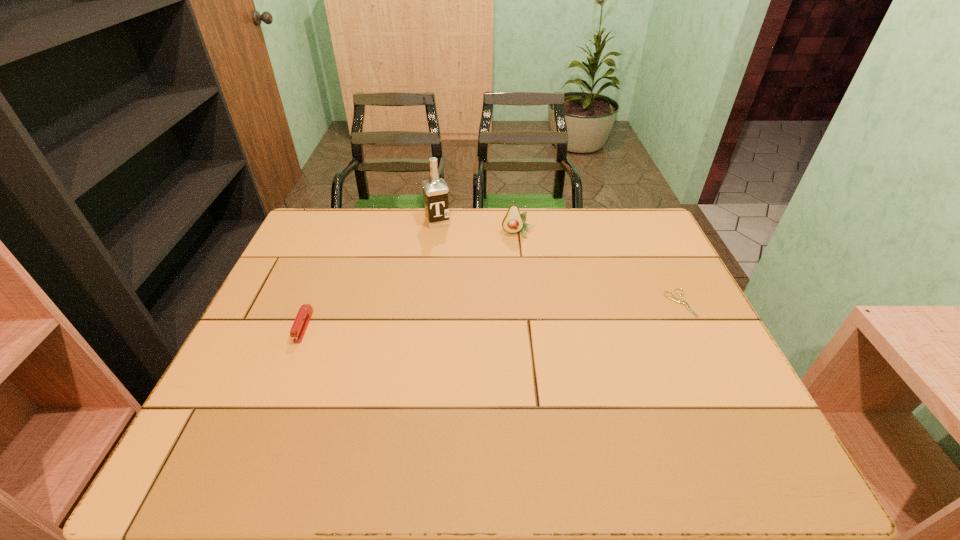
What are the coordinates of `the leftmost object` in the screenshot? It's located at (303, 317).

I want to click on stapler, so click(303, 317).

Identify the location of the rightmost object. (672, 297).

Locate an element on the screen. Image resolution: width=960 pixels, height=540 pixels. shears is located at coordinates (672, 297).

Image resolution: width=960 pixels, height=540 pixels. I want to click on the second object from left to right, so click(435, 190).

Locate an element on the screen. the tallest object is located at coordinates (435, 190).

This screenshot has height=540, width=960. In order to click on the second object from right to left in this screenshot , I will do point(513,222).

Locate an element on the screen. This screenshot has width=960, height=540. avocado is located at coordinates (513, 222).

Identify the location of vacant space situated on the front-facing side of the leftmost object. The image size is (960, 540). (283, 377).

Where is `free point located 0.170m on the back of the rightmost object`? The image size is (960, 540). free point located 0.170m on the back of the rightmost object is located at coordinates (655, 252).